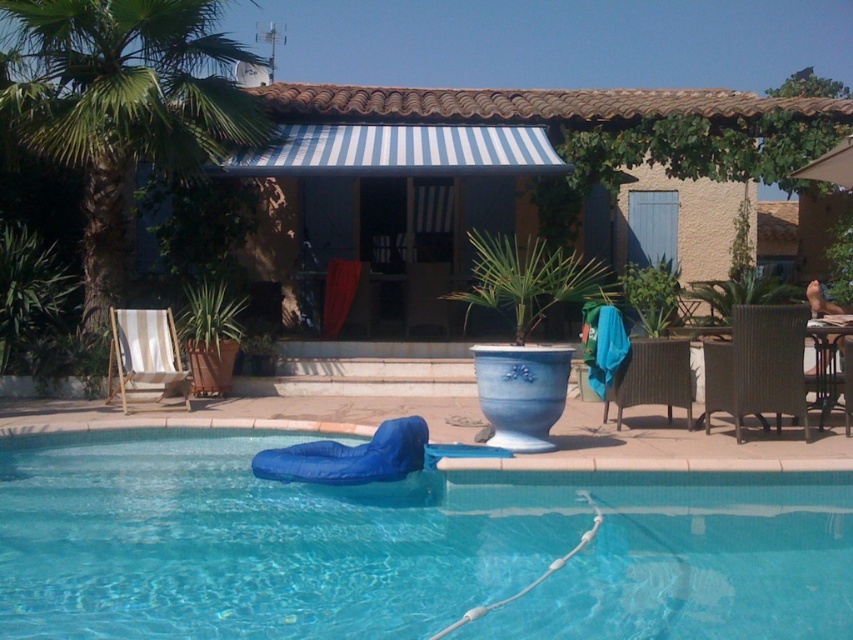
You are a gardener who needs to water the green leafy palm tree at left and the brown wicker chair at lower right. If your watering can holds enough water for 5 meters of travel, can you water both without refilling?

The distance between the green leafy palm tree at left and brown wicker chair at lower right is 6.15 meters. Since the watering can can only cover 5 meters, you cannot water both without refilling.

From the picture: You are a delivery person carrying a package that is 3 meters long. You need to place it between the blue fabric at lower center and the brown wicker chair at lower right. Is there enough space to fit the package between them?

The blue fabric at lower center and brown wicker chair at lower right are 2.97 meters apart from each other. Since the package is 3 meters long, it is slightly longer than the available space. Therefore, the package cannot fit between them.

Consider the image. You are standing at the center of the patio and want to move towards the green leafy palm tree at left. Which direction should you walk to reach it?

The green leafy palm tree at left is located at point 0.167 on the x and 0.144 on the y coordinate. Since you are at the center, you should walk towards the left and slightly forward to reach it.